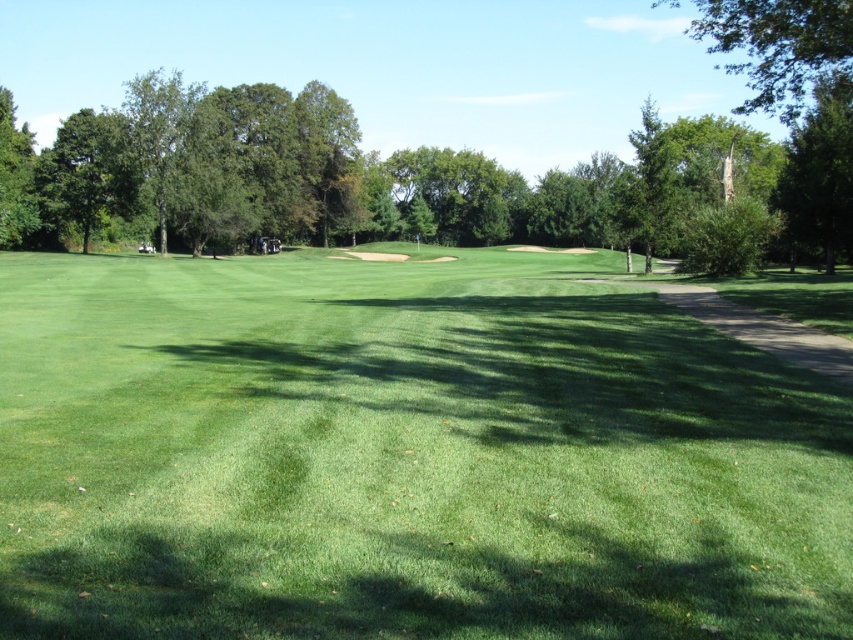
Question: Which point is closer to the camera?

Choices:
 (A) green leafy tree at left
 (B) green grassy field at center
 (C) green leafy tree at upper right

Answer: (B)

Question: Does green grassy field at center appear on the right side of green leafy tree at upper right?

Choices:
 (A) no
 (B) yes

Answer: (A)

Question: Which point is farther to the camera?

Choices:
 (A) green leafy tree at left
 (B) green grassy field at center

Answer: (A)

Question: Where is green grassy field at center located in relation to green leafy tree at upper right in the image?

Choices:
 (A) above
 (B) below

Answer: (B)

Question: Which of these objects is positioned farthest from the green grassy field at center?

Choices:
 (A) green leafy tree at left
 (B) green leafy tree at upper right

Answer: (B)

Question: Does green leafy tree at upper right have a greater width compared to green leafy tree at left?

Choices:
 (A) yes
 (B) no

Answer: (A)